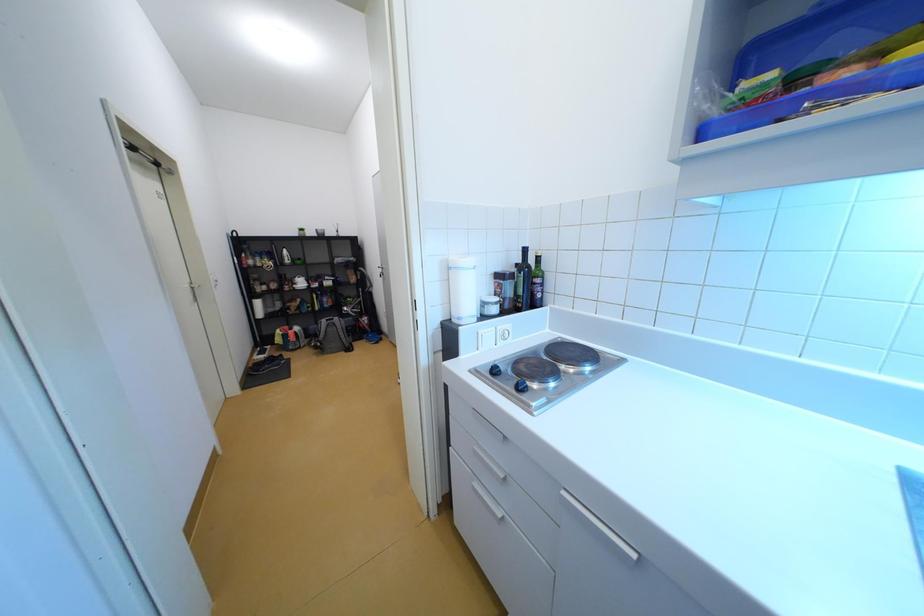
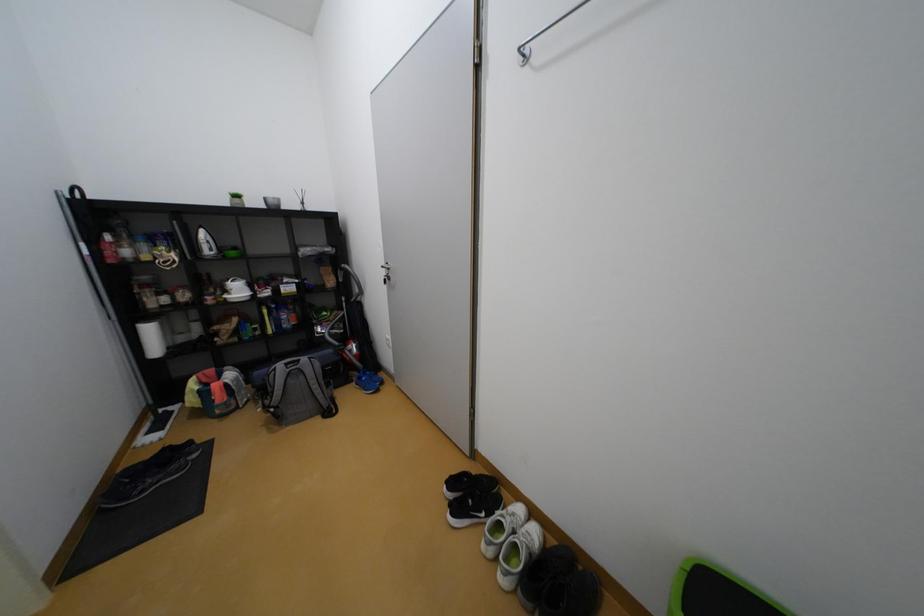
In a continuous first-person perspective shot, in which direction is the camera moving?

The movement direction of the cameraman is left, forward.